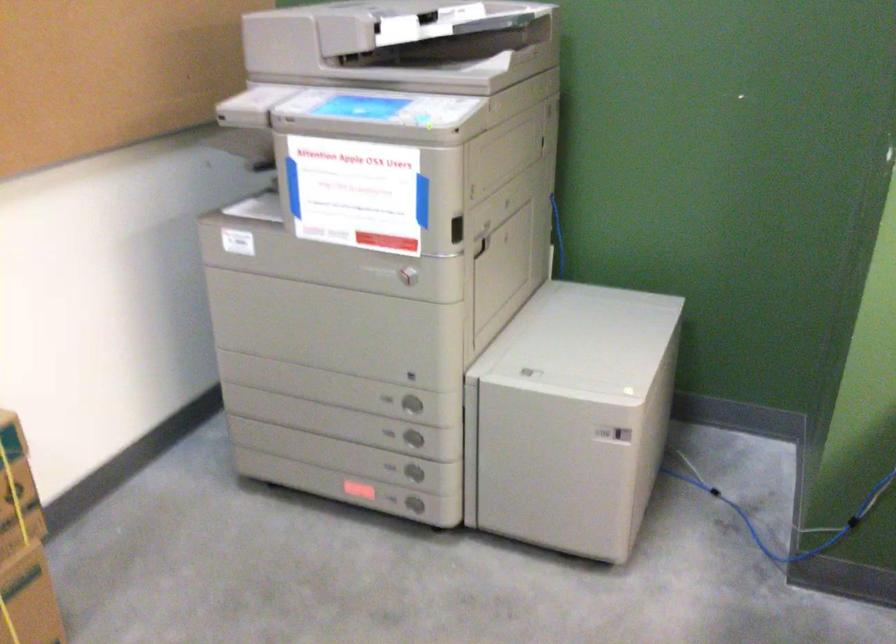
Where is `copier document feeder`? copier document feeder is located at coordinates (424, 28).